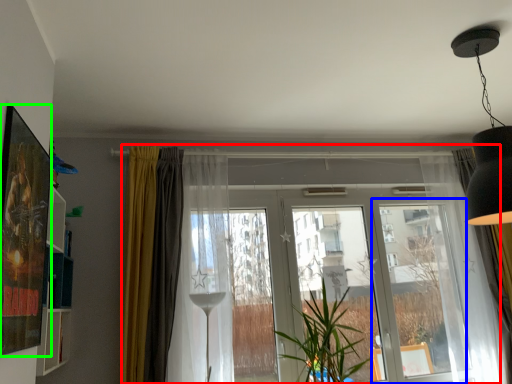
Question: Which is nearer to the window (highlighted by a red box)? screen door (highlighted by a blue box) or picture frame (highlighted by a green box).

Choices:
 (A) screen door
 (B) picture frame

Answer: (A)